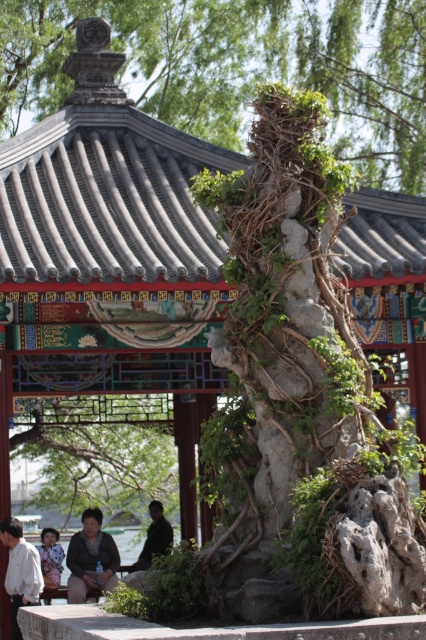
You are standing in front of the traditional Chinese pavilion and want to know how far you are from the point marked at coordinates point (71, 406). Can you determine the distance?

The point marked at coordinates point (71, 406) is 191.38 feet away from you.

You are a visitor standing at the entrance of the traditional Chinese pavilion. You notice a green leafy tree at center and a matte black jacket at lower left. Which object is taller?

The green leafy tree at center is much taller than the matte black jacket at lower left according to the description.